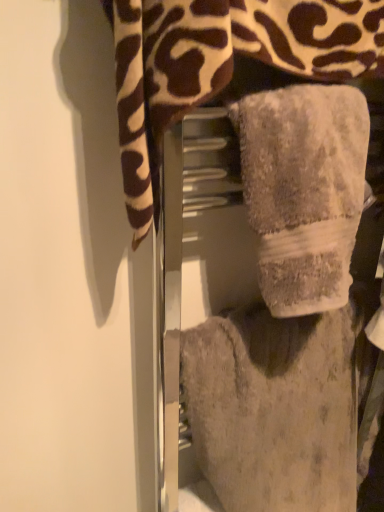
Question: From a real-world perspective, is gray fluffy towel at center, marked as the 2th towel in a top-to-bottom arrangement, located higher than gray plush towel at center, the 3th towel when ordered from bottom to top?

Choices:
 (A) yes
 (B) no

Answer: (B)

Question: Is the position of gray fluffy towel at center, marked as the 2th towel in a top-to-bottom arrangement, more distant than that of gray plush towel at center, positioned as the 1th towel in top-to-bottom order?

Choices:
 (A) no
 (B) yes

Answer: (B)

Question: Could you tell me if gray fluffy towel at center, which is counted as the 2th towel, starting from the bottom, is turned towards gray plush towel at center, positioned as the 1th towel in top-to-bottom order?

Choices:
 (A) yes
 (B) no

Answer: (A)

Question: Considering the relative sizes of gray fluffy towel at center, which is counted as the 2th towel, starting from the bottom, and gray plush towel at center, the 3th towel when ordered from bottom to top, in the image provided, is gray fluffy towel at center, which is counted as the 2th towel, starting from the bottom, smaller than gray plush towel at center, the 3th towel when ordered from bottom to top,?

Choices:
 (A) no
 (B) yes

Answer: (B)

Question: Can you confirm if gray fluffy towel at center, which is counted as the 2th towel, starting from the bottom, is wider than gray plush towel at center, the 3th towel when ordered from bottom to top?

Choices:
 (A) yes
 (B) no

Answer: (B)

Question: Looking at their shapes, would you say gray fluffy towel at center, which is counted as the 2th towel, starting from the bottom, is wider or thinner than fuzzy gray towel at center, which ranks as the 1th towel in bottom-to-top order?

Choices:
 (A) thin
 (B) wide

Answer: (A)

Question: From the image's perspective, is gray fluffy towel at center, which is counted as the 2th towel, starting from the bottom, located above or below fuzzy gray towel at center, which ranks as the 1th towel in bottom-to-top order?

Choices:
 (A) above
 (B) below

Answer: (A)

Question: In terms of size, does gray fluffy towel at center, which is counted as the 2th towel, starting from the bottom, appear bigger or smaller than fuzzy gray towel at center, which ranks as the 1th towel in bottom-to-top order?

Choices:
 (A) small
 (B) big

Answer: (A)

Question: Visually, is gray fluffy towel at center, marked as the 2th towel in a top-to-bottom arrangement, positioned to the left or to the right of fuzzy gray towel at center, the 3th towel viewed from the top?

Choices:
 (A) right
 (B) left

Answer: (B)

Question: Based on their sizes in the image, would you say gray plush towel at center, the 3th towel when ordered from bottom to top, is bigger or smaller than fuzzy gray towel at center, which ranks as the 1th towel in bottom-to-top order?

Choices:
 (A) small
 (B) big

Answer: (A)

Question: In terms of height, does gray plush towel at center, the 3th towel when ordered from bottom to top, look taller or shorter compared to fuzzy gray towel at center, which ranks as the 1th towel in bottom-to-top order?

Choices:
 (A) tall
 (B) short

Answer: (B)

Question: Based on their positions, is gray plush towel at center, the 3th towel when ordered from bottom to top, located to the left or right of fuzzy gray towel at center, the 3th towel viewed from the top?

Choices:
 (A) right
 (B) left

Answer: (B)

Question: From the image's perspective, is gray plush towel at center, the 3th towel when ordered from bottom to top, above or below fuzzy gray towel at center, the 3th towel viewed from the top?

Choices:
 (A) below
 (B) above

Answer: (B)

Question: In terms of size, does fuzzy gray towel at center, the 3th towel viewed from the top, appear bigger or smaller than gray plush towel at center, positioned as the 1th towel in top-to-bottom order?

Choices:
 (A) small
 (B) big

Answer: (B)

Question: From a real-world perspective, relative to gray plush towel at center, the 3th towel when ordered from bottom to top, is fuzzy gray towel at center, the 3th towel viewed from the top, vertically above or below?

Choices:
 (A) above
 (B) below

Answer: (B)